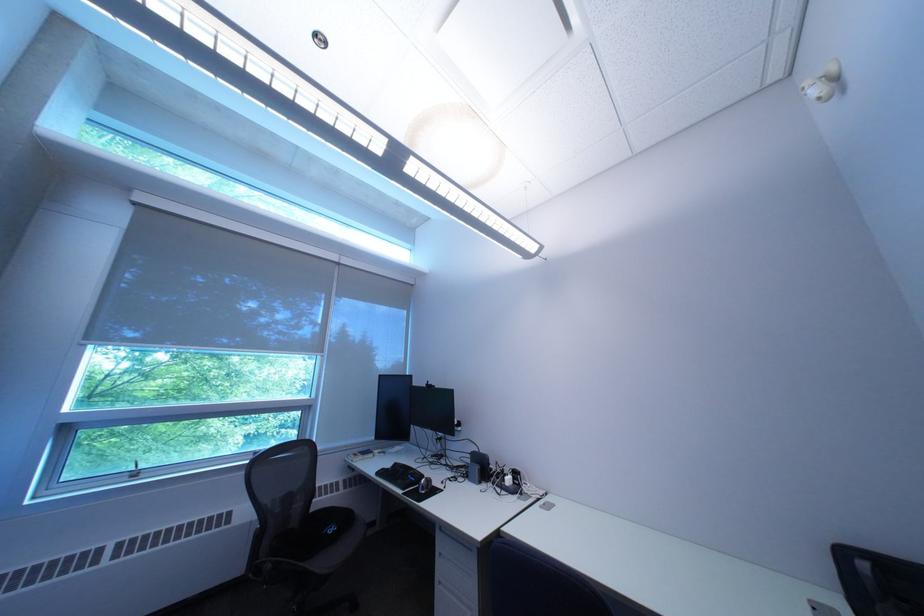
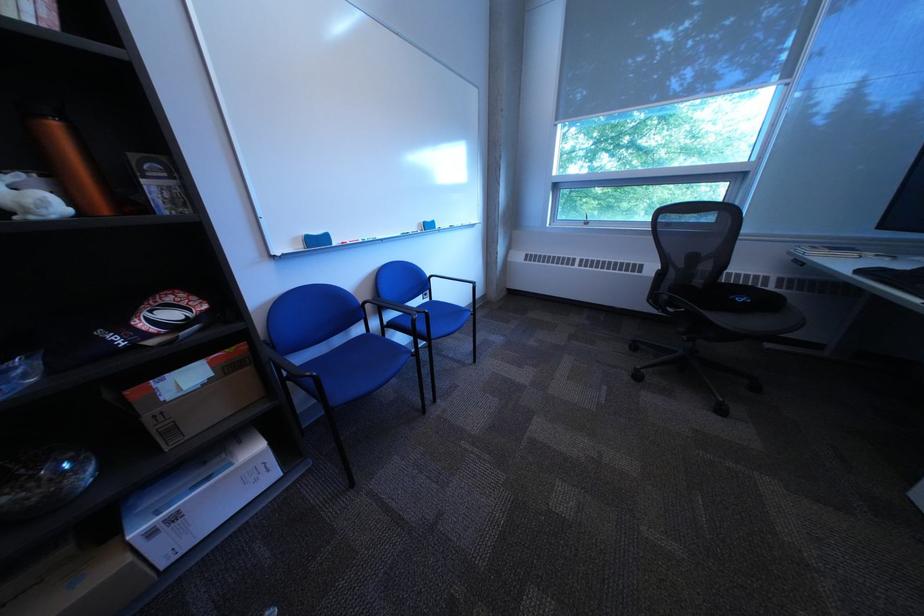
First-person continuous shooting, in which direction is the camera rotating?

The camera's rotation is toward left-down.